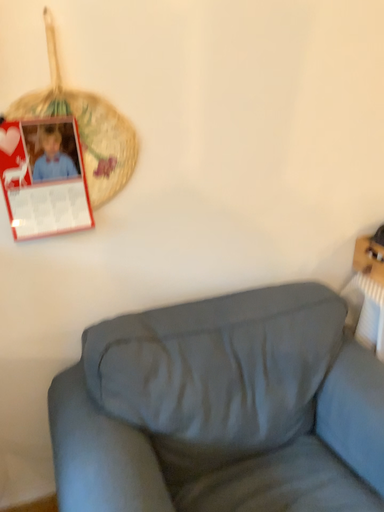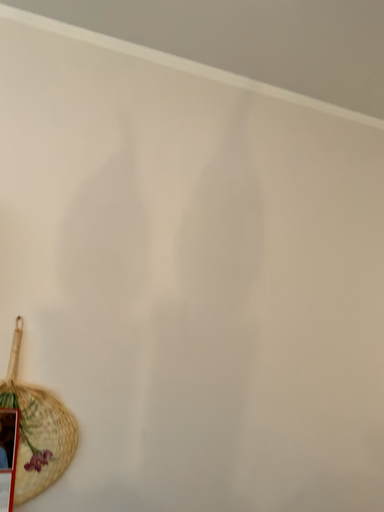
Question: Which way did the camera rotate in the video?

Choices:
 (A) rotated downward
 (B) rotated upward

Answer: (B)